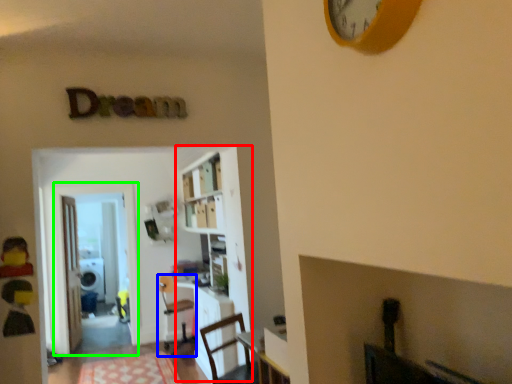
Question: Estimate the real-world distances between objects in this image. Which object is farther from bookcase (highlighted by a red box), chair (highlighted by a blue box) or glass door (highlighted by a green box)?

Choices:
 (A) chair
 (B) glass door

Answer: (B)